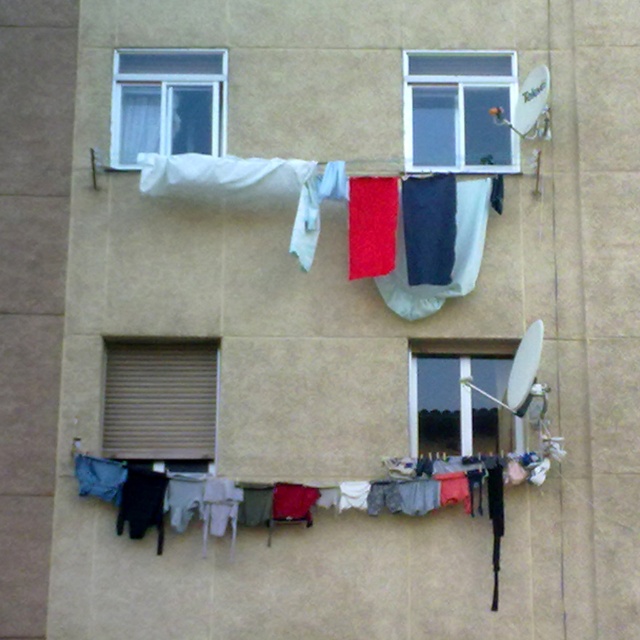
You are a window installer assessing the building exterior. You need to replace the clear glass window at upper center and the white fabric at upper left. Which object requires a larger replacement material?

The clear glass window at upper center requires a larger replacement material because it is larger in size than the white fabric at upper left.

You are a window cleaner who needs to clean both the brown matte shutter at lower left and the clear glass window at upper center. The ladder you have can reach up to 3 meters. If you stand at the base of the wall, can you clean both objects without moving the ladder?

The brown matte shutter at lower left and clear glass window at upper center are 3.49 meters apart from each other. Since the ladder can only reach up to 3 meters, the distance between them exceeds the ladder length, so you cannot clean both without moving the ladder.